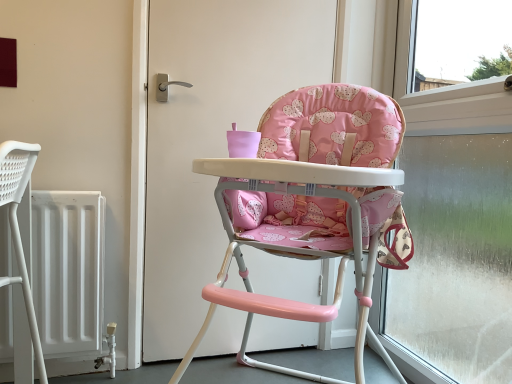
Question: Are pink fabric highchair at center and white matte door at center beside each other?

Choices:
 (A) yes
 (B) no

Answer: (B)

Question: From the image's perspective, does pink fabric highchair at center appear lower than white matte door at center?

Choices:
 (A) yes
 (B) no

Answer: (A)

Question: Is pink fabric highchair at center to the left of white matte door at center from the viewer's perspective?

Choices:
 (A) yes
 (B) no

Answer: (B)

Question: Does pink fabric highchair at center appear on the right side of white matte door at center?

Choices:
 (A) yes
 (B) no

Answer: (A)

Question: From a real-world perspective, is pink fabric highchair at center under white matte door at center?

Choices:
 (A) yes
 (B) no

Answer: (A)

Question: Is pink fabric highchair at center not near white matte door at center?

Choices:
 (A) no
 (B) yes

Answer: (A)

Question: From the image's perspective, would you say white matte door at center is shown under transparent glass window at right?

Choices:
 (A) no
 (B) yes

Answer: (A)

Question: Does white matte door at center contain transparent glass window at right?

Choices:
 (A) no
 (B) yes

Answer: (A)

Question: Can you confirm if white matte door at center is thinner than transparent glass window at right?

Choices:
 (A) yes
 (B) no

Answer: (A)

Question: Is white matte door at center behind transparent glass window at right?

Choices:
 (A) no
 (B) yes

Answer: (B)

Question: Is white matte door at center closer to the viewer compared to transparent glass window at right?

Choices:
 (A) yes
 (B) no

Answer: (B)

Question: Are white matte door at center and transparent glass window at right making contact?

Choices:
 (A) yes
 (B) no

Answer: (B)

Question: Can pink fabric highchair at center be found inside transparent glass window at right?

Choices:
 (A) no
 (B) yes

Answer: (A)